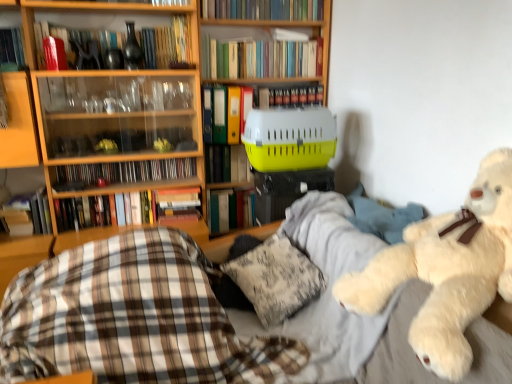
In order to click on empty space that is ontop of hardcover books at upper center, the seventh book ordered from the bottom in this screenshot , I will do `click(289, 82)`.